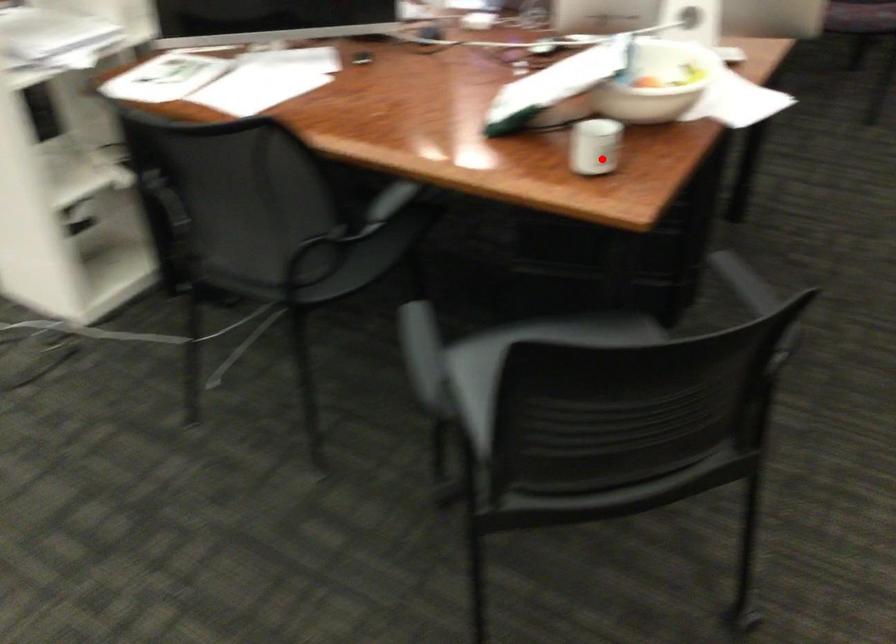
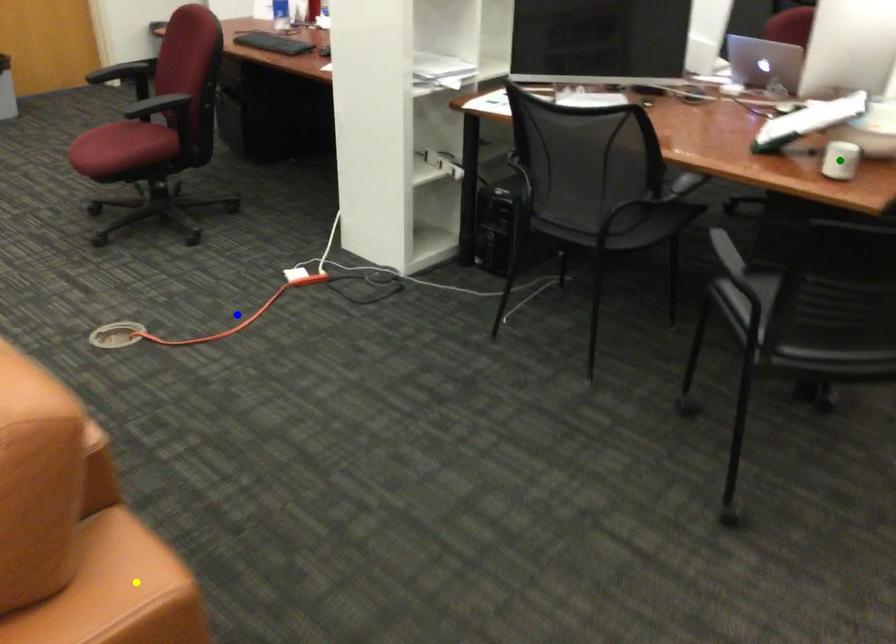
Question: I am providing you with two images of the same scene from different viewpoints. A red point is marked on the first image. You are given multiple points on the second image. Which point in image 2 represents the same 3d spot as the red point in image 1?

Choices:
 (A) yellow point
 (B) blue point
 (C) green point

Answer: (C)